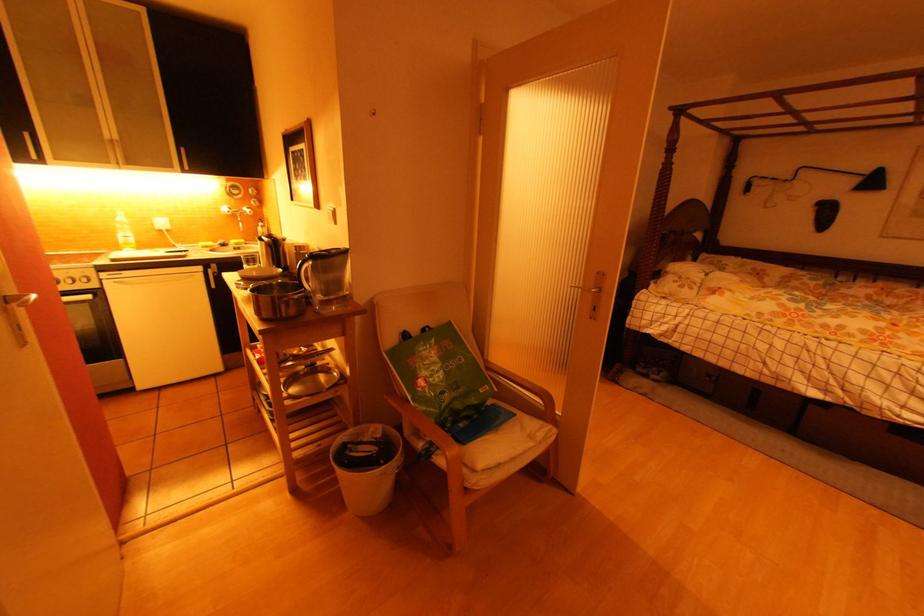
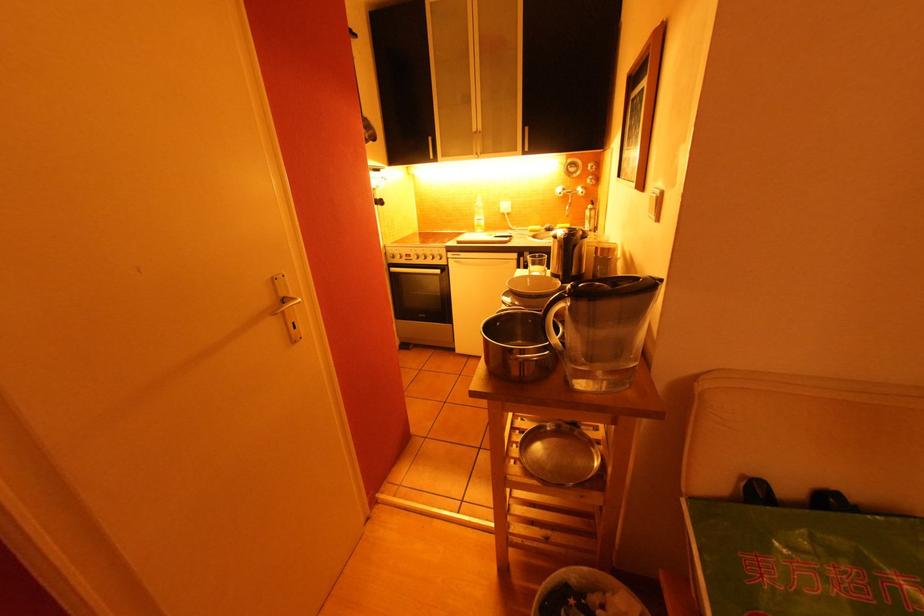
Locate, in the second image, the point that corresponds to (419,365) in the first image.

(766, 578)